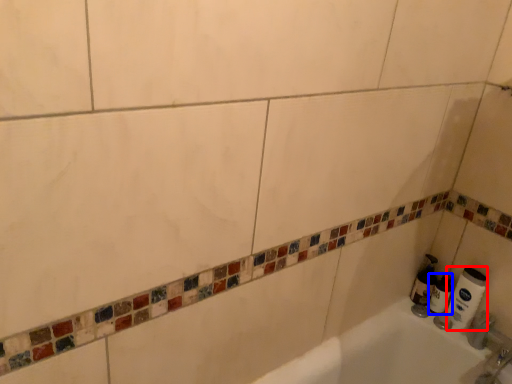
Question: Which object is closer to the camera taking this photo, toilet paper (highlighted by a red box) or toilet paper (highlighted by a blue box)?

Choices:
 (A) toilet paper
 (B) toilet paper

Answer: (A)